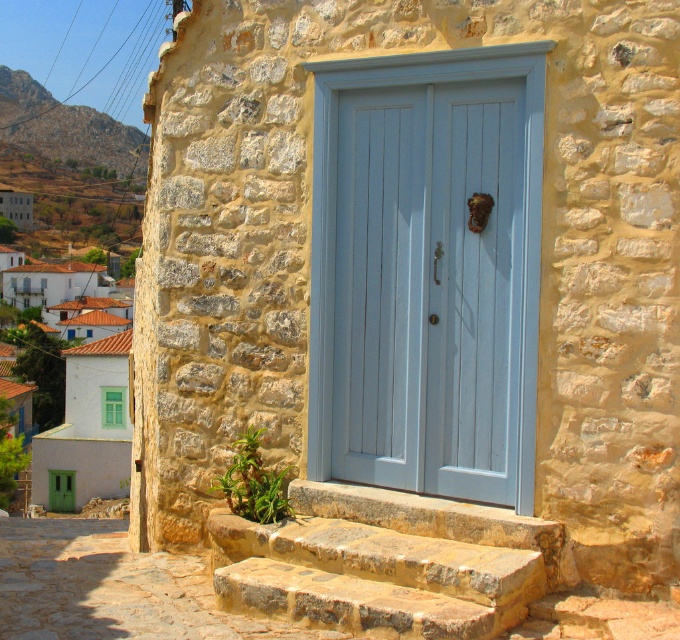
Question: Is natural stone steps at center thinner than white painted wall at left?

Choices:
 (A) yes
 (B) no

Answer: (A)

Question: Which of the following is the closest to the observer?

Choices:
 (A) (51, 108)
 (B) (447, 458)

Answer: (B)

Question: Observing the image, what is the correct spatial positioning of light blue wooden door at center in reference to white painted wall at left?

Choices:
 (A) above
 (B) below

Answer: (B)

Question: Which point is farther to the camera?

Choices:
 (A) (71, 326)
 (B) (333, 444)
 (C) (84, 140)
 (D) (471, 504)

Answer: (C)

Question: Among these objects, which one is nearest to the camera?

Choices:
 (A) rustic stone hillside at upper left
 (B) light blue wooden door at center
 (C) white painted wall at left

Answer: (B)

Question: Is natural stone steps at center below rustic stone hillside at upper left?

Choices:
 (A) no
 (B) yes

Answer: (B)